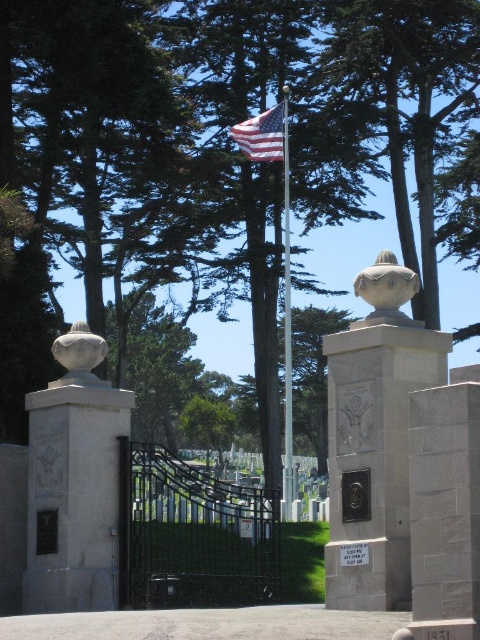
Question: Which object is the closest to the gray stone monument at center?

Choices:
 (A) white stone sculpture at center
 (B) white stone sphere at left
 (C) matte bronze sculpture at center

Answer: (C)

Question: Is gray stone monument at center to the right of white stone sculpture at center from the viewer's perspective?

Choices:
 (A) no
 (B) yes

Answer: (A)

Question: Which point appears farthest from the camera in this image?

Choices:
 (A) (49, 502)
 (B) (404, 275)
 (C) (80, 323)

Answer: (C)

Question: Based on their relative distances, which object is farther from the white stone urn at center?

Choices:
 (A) white stone sphere at left
 (B) gray stone monument at center
 (C) american flag at upper center
 (D) polished metal flag pole at center

Answer: (C)

Question: Is polished metal flag pole at center below white stone sphere at left?

Choices:
 (A) no
 (B) yes

Answer: (B)

Question: Is the position of white stone sphere at left more distant than that of american flag at upper center?

Choices:
 (A) yes
 (B) no

Answer: (B)